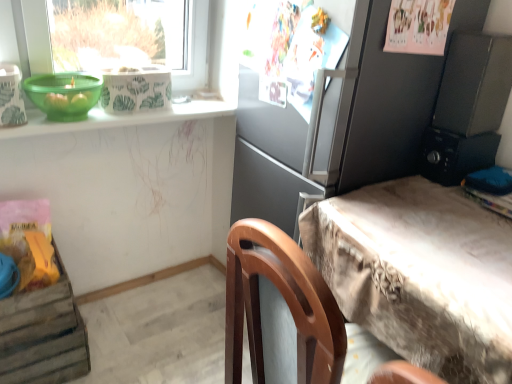
Identify the location of free point above black plastic radio at upper right (from a real-world perspective). This screenshot has width=512, height=384. (461, 132).